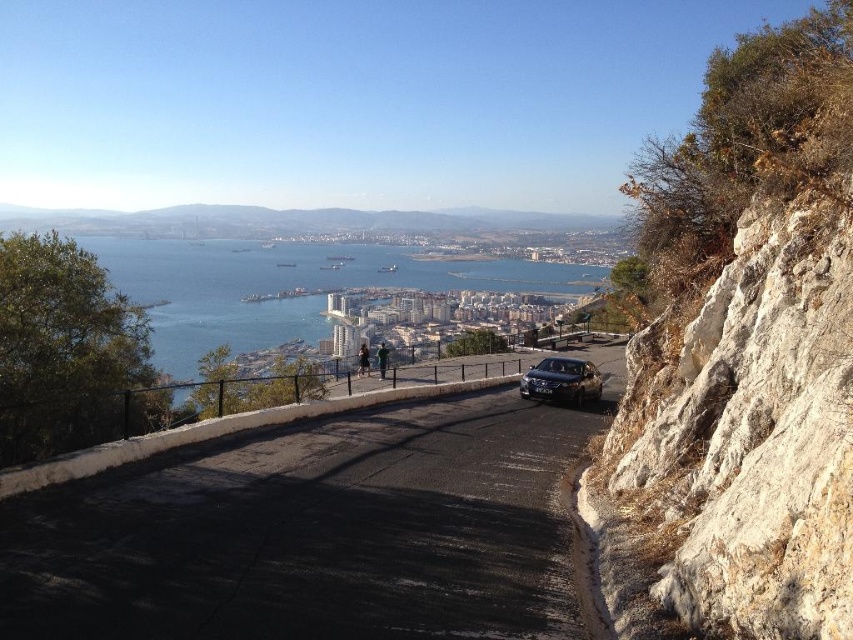
Question: Is black asphalt road at center positioned in front of white rocky cliff at right?

Choices:
 (A) yes
 (B) no

Answer: (B)

Question: Can you confirm if blue water at center is positioned to the left of satin black car at lower right?

Choices:
 (A) no
 (B) yes

Answer: (B)

Question: Which object is positioned closest to the black asphalt road at center?

Choices:
 (A) blue water at center
 (B) satin black car at lower right
 (C) white rocky cliff at right

Answer: (C)

Question: Does white rocky cliff at right have a larger size compared to satin black car at lower right?

Choices:
 (A) yes
 (B) no

Answer: (A)

Question: Which object is farther from the camera taking this photo?

Choices:
 (A) black asphalt road at center
 (B) satin black car at lower right
 (C) white rocky cliff at right

Answer: (B)

Question: Which object is closer to the camera taking this photo?

Choices:
 (A) satin black car at lower right
 (B) black asphalt road at center
 (C) white rocky cliff at right
 (D) blue water at center

Answer: (C)